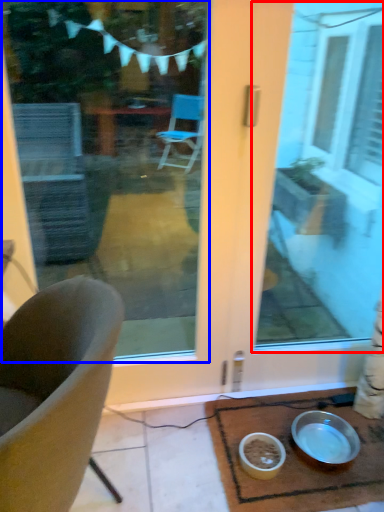
Question: Among these objects, which one is nearest to the camera, window screen (highlighted by a red box) or window screen (highlighted by a blue box)?

Choices:
 (A) window screen
 (B) window screen

Answer: (B)